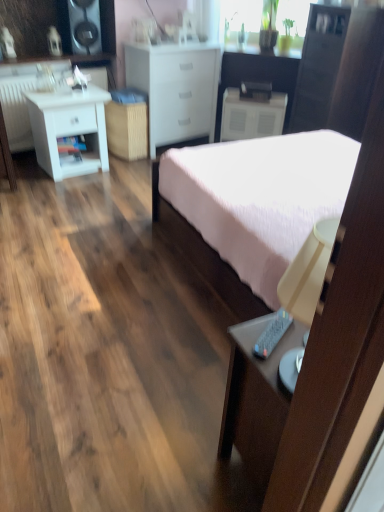
Question: Is black plastic remote control at lower right to the left or to the right of white matte chest of drawers at center in the image?

Choices:
 (A) right
 (B) left

Answer: (A)

Question: Do you think black plastic remote control at lower right is within white matte chest of drawers at center, or outside of it?

Choices:
 (A) outside
 (B) inside

Answer: (A)

Question: Based on their relative distances, which object is farther from the white matte nightstand at left, arranged as the 2th nightstand when viewed from the right?

Choices:
 (A) white matte nightstand at center, the 1th nightstand in the right-to-left sequence
 (B) black plastic remote control at lower right
 (C) matte black cabinet at upper right
 (D) white matte chest of drawers at center
 (E) pink fabric bed at center

Answer: (B)

Question: Estimate the real-world distances between objects in this image. Which object is farther from the pink fabric bed at center?

Choices:
 (A) white matte chest of drawers at center
 (B) matte black cabinet at upper right
 (C) white matte nightstand at left, arranged as the 2th nightstand when viewed from the back
 (D) black plastic remote control at lower right
 (E) black glossy speaker at upper left

Answer: (E)